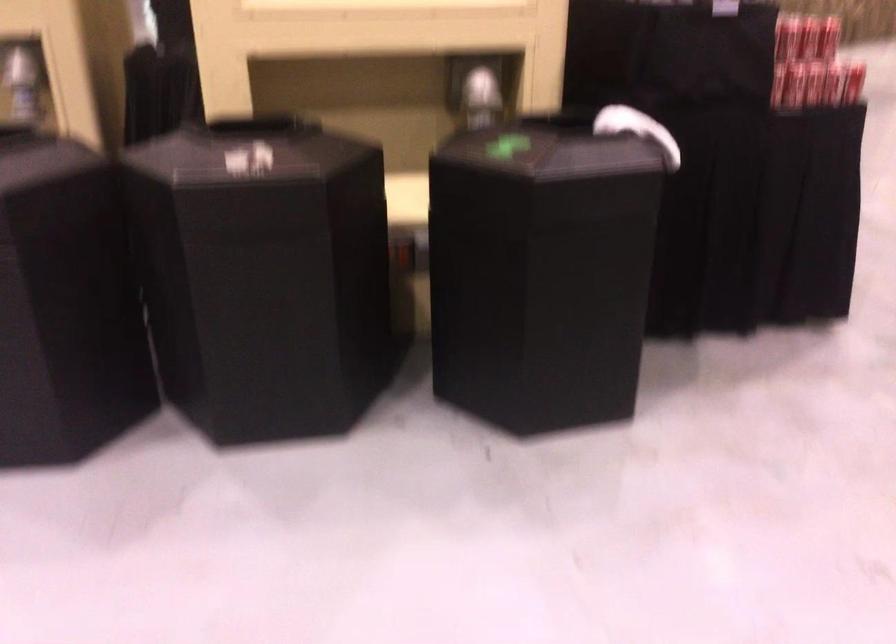
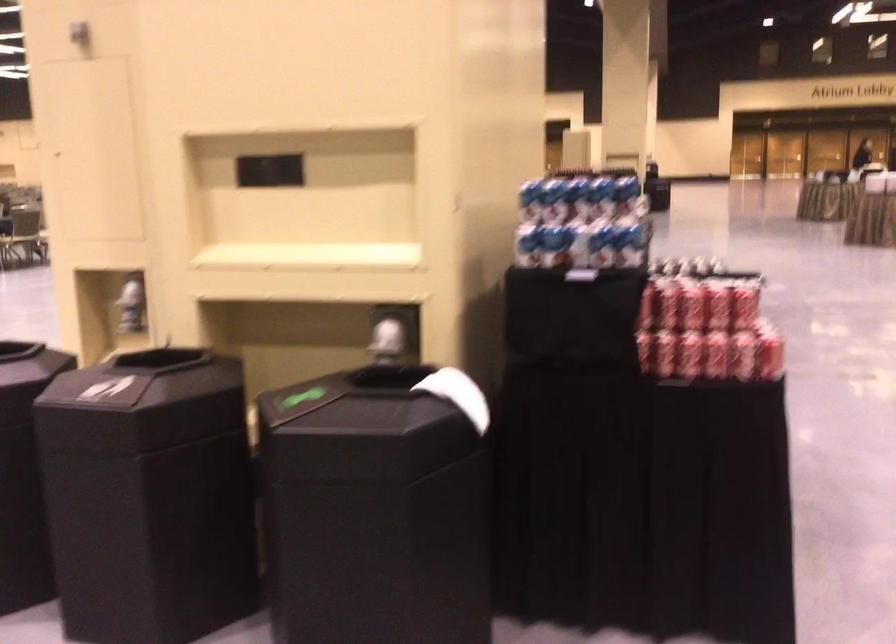
Find the pixel in the second image that matches point (804, 80) in the first image.

(688, 355)